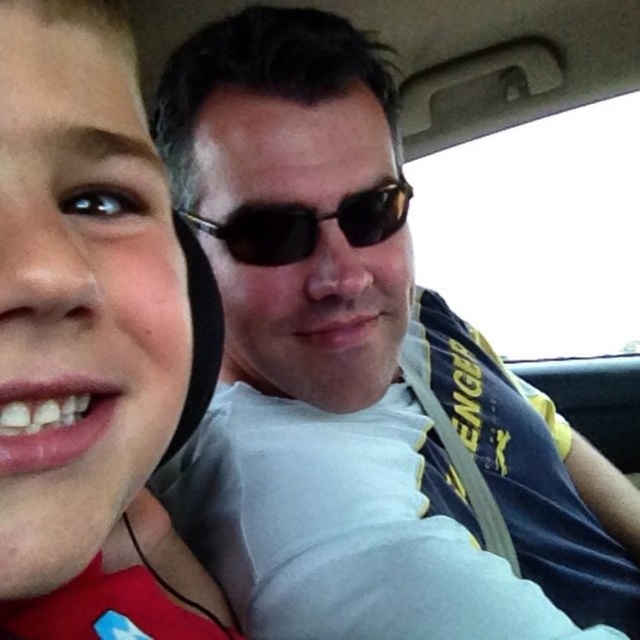
Question: Which object appears closest to the camera in this image?

Choices:
 (A) matte black hoodie at left
 (B) black plastic sunglasses at center

Answer: (A)

Question: Does matte black hoodie at left have a lesser width compared to black plastic sunglasses at center?

Choices:
 (A) no
 (B) yes

Answer: (B)

Question: Is matte black hoodie at left further to the viewer compared to black plastic sunglasses at center?

Choices:
 (A) yes
 (B) no

Answer: (B)

Question: Can you confirm if matte black hoodie at left is positioned to the right of black plastic sunglasses at center?

Choices:
 (A) yes
 (B) no

Answer: (B)

Question: Which point is closer to the camera?

Choices:
 (A) (4, 232)
 (B) (248, 248)

Answer: (A)